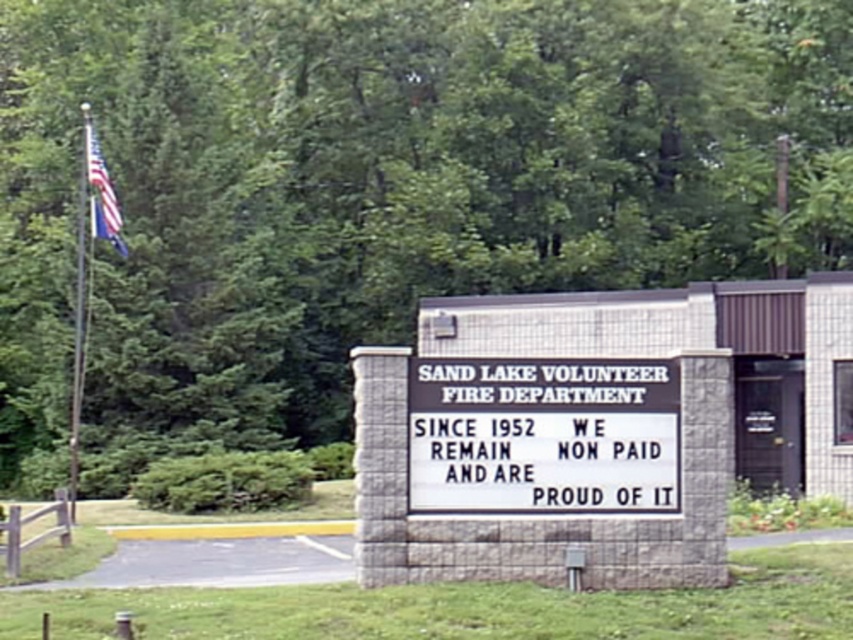
Is white plastic sign at center further to the viewer compared to american flag at upper left?

That is False.

Can you confirm if white plastic sign at center is wider than american flag at upper left?

Indeed, white plastic sign at center has a greater width compared to american flag at upper left.

This screenshot has height=640, width=853. Identify the location of white plastic sign at center. (543, 435).